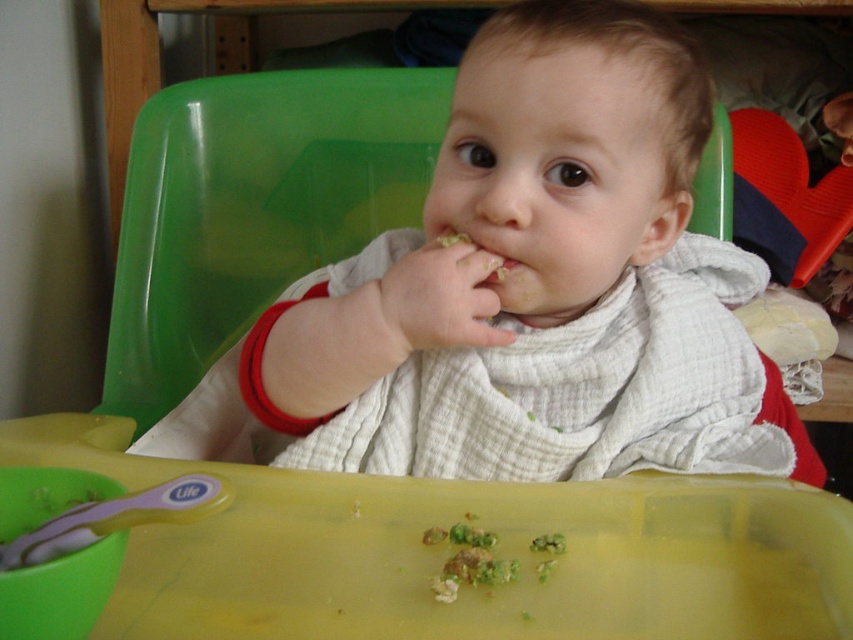
Question: Which of the following is the closest to the observer?

Choices:
 (A) green textured food at tray center
 (B) fuzzy white food at mouth center
 (C) white textured bib at center

Answer: (A)

Question: Is white textured bib at center bigger than fuzzy white food at mouth center?

Choices:
 (A) no
 (B) yes

Answer: (B)

Question: Among these points, which one is nearest to the camera?

Choices:
 (A) (514, 266)
 (B) (541, 534)

Answer: (B)

Question: Is green textured food at tray center positioned in front of fuzzy white food at mouth center?

Choices:
 (A) yes
 (B) no

Answer: (A)

Question: Can you confirm if white textured bib at center is thinner than fuzzy white food at mouth center?

Choices:
 (A) yes
 (B) no

Answer: (B)

Question: Which point is farther from the camera taking this photo?

Choices:
 (A) (469, 557)
 (B) (561, 83)

Answer: (B)